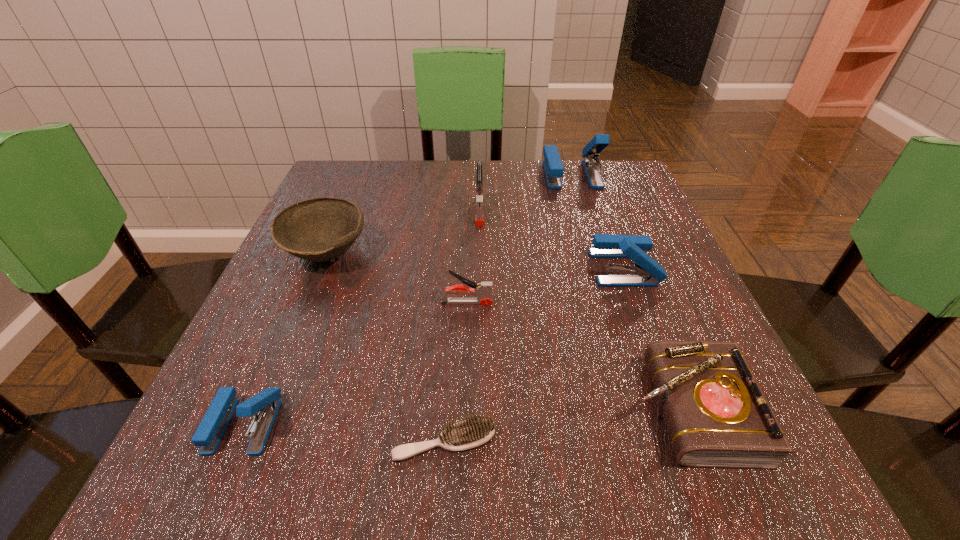
I want to click on blank space at the far edge of the desktop, so click(x=460, y=198).

Locate an element on the screen. This screenshot has height=540, width=960. vacant space at the near edge of the desktop is located at coordinates (365, 488).

This screenshot has height=540, width=960. In the image, there is a desktop. Identify the location of vacant space at the left edge. (342, 314).

In the image, there is a desktop. Identify the location of free space at the right edge. Image resolution: width=960 pixels, height=540 pixels. (625, 299).

Image resolution: width=960 pixels, height=540 pixels. I want to click on free space between the shortest object and the seventh tallest object, so click(565, 426).

The image size is (960, 540). In order to click on free area in between the nearer gray stapler and the bowl in this screenshot , I will do [396, 278].

Locate an element on the screen. The width and height of the screenshot is (960, 540). vacant region between the leftmost blue stapler and the scrubbing brush is located at coordinates (345, 433).

Image resolution: width=960 pixels, height=540 pixels. What are the coordinates of `free space between the diary and the second farthest stapler` in the screenshot? It's located at (584, 310).

I want to click on free point between the bowl and the diary, so click(x=507, y=331).

At what (x,y) coordinates should I click in order to perform the action: click on unoccupied area between the second smallest blue stapler and the fourth nearest stapler. Please return your answer as a coordinate pair (x, y). This screenshot has width=960, height=540. Looking at the image, I should click on (552, 239).